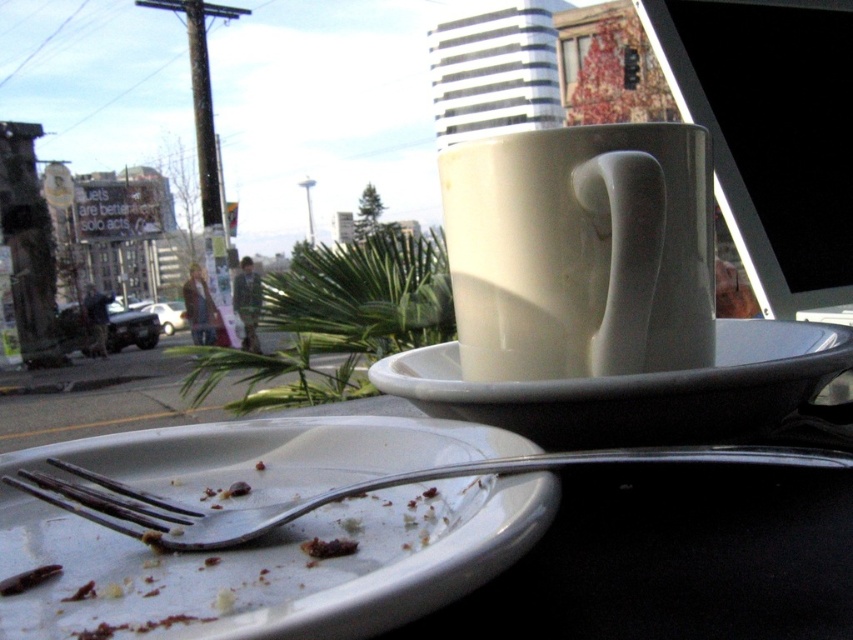
You are sitting in the vehicle and want to reach the point at coordinates point (277, 605). If your hand can extend 8 inches forward, can you comfortably reach that point?

The distance of point (277, 605) from viewer is 7.99 inches, so yes, you can comfortably reach that point since your hand can extend 8 inches forward.

You are a passenger in a car and want to place your coffee mug somewhere safe. You see the white ceramic mug at upper center and the white matte saucer at center. Which object is located higher up and would be a better spot to prevent spills?

The white ceramic mug at upper center is above the white matte saucer at center, so placing the mug higher up would be safer to prevent spills.

You are a passenger in the car and want to reach for both the white matte plate at lower left and the white ceramic mug at upper center. Which one is closer to you?

The white matte plate at lower left is closer to you because it is positioned lower than the white ceramic mug at upper center, which is placed higher up on the dashboard.